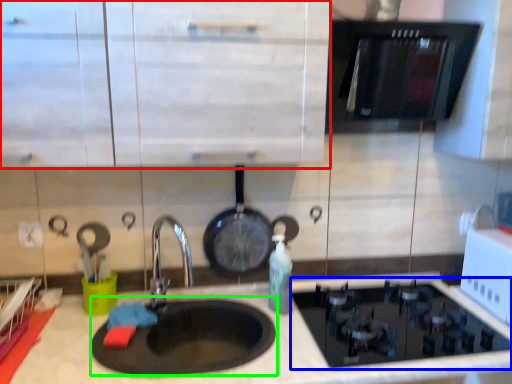
Question: Considering the real-world distances, which object is farthest from cabinetry (highlighted by a red box)? gas stove (highlighted by a blue box) or pizza pan (highlighted by a green box)?

Choices:
 (A) gas stove
 (B) pizza pan

Answer: (A)